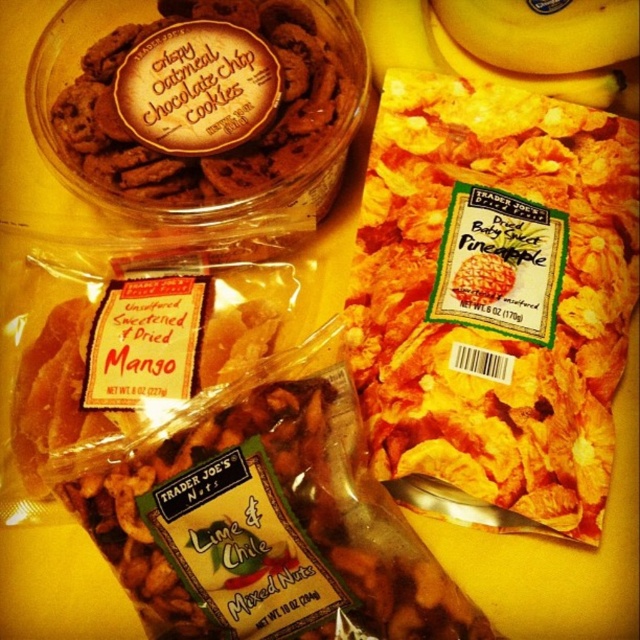
Is crispy oatmeal chocolate chip cookies at upper left thinner than yellow smooth banana at upper center?

Incorrect, crispy oatmeal chocolate chip cookies at upper left's width is not less than yellow smooth banana at upper center's.

You are a GUI agent. You are given a task and a screenshot of the screen. Output one action in this format:
    pyautogui.click(x=<x>, y=<y>)
    Task: Click on the crispy oatmeal chocolate chip cookies at upper left
    This screenshot has width=640, height=640.
    Given the screenshot: What is the action you would take?
    pyautogui.click(x=218, y=148)

This screenshot has width=640, height=640. Identify the location of crispy oatmeal chocolate chip cookies at upper left. (218, 148).

Is yellow crunchy pineapple at upper right in front of crispy oatmeal chocolate chip cookies at upper left?

That is True.

Who is shorter, yellow crunchy pineapple at upper right or crispy oatmeal chocolate chip cookies at upper left?

Standing shorter between the two is crispy oatmeal chocolate chip cookies at upper left.

The image size is (640, 640). Identify the location of yellow crunchy pineapple at upper right. (496, 292).

Can you confirm if yellow crunchy pineapple at upper right is thinner than yellow smooth banana at upper center?

Indeed, yellow crunchy pineapple at upper right has a lesser width compared to yellow smooth banana at upper center.

At what (x,y) coordinates should I click in order to perform the action: click on yellow crunchy pineapple at upper right. Please return your answer as a coordinate pair (x, y). This screenshot has width=640, height=640. Looking at the image, I should click on (496, 292).

Where is `yellow crunchy pineapple at upper right`? The height and width of the screenshot is (640, 640). yellow crunchy pineapple at upper right is located at coordinates (496, 292).